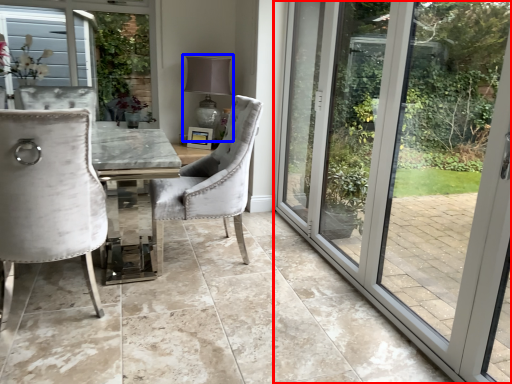
Question: Among these objects, which one is farthest to the camera, door (highlighted by a red box) or lamp (highlighted by a blue box)?

Choices:
 (A) door
 (B) lamp

Answer: (B)